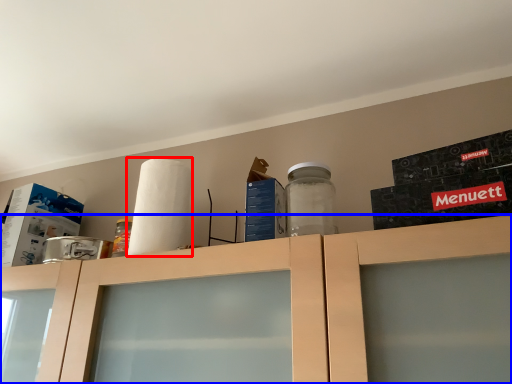
Question: Which object is further to the camera taking this photo, paper towel (highlighted by a red box) or cabinetry (highlighted by a blue box)?

Choices:
 (A) paper towel
 (B) cabinetry

Answer: (A)